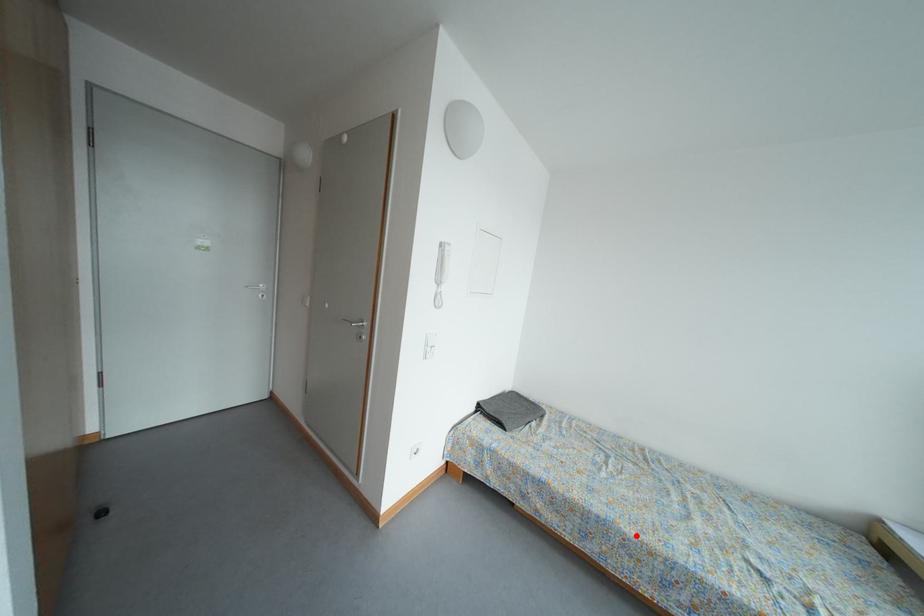
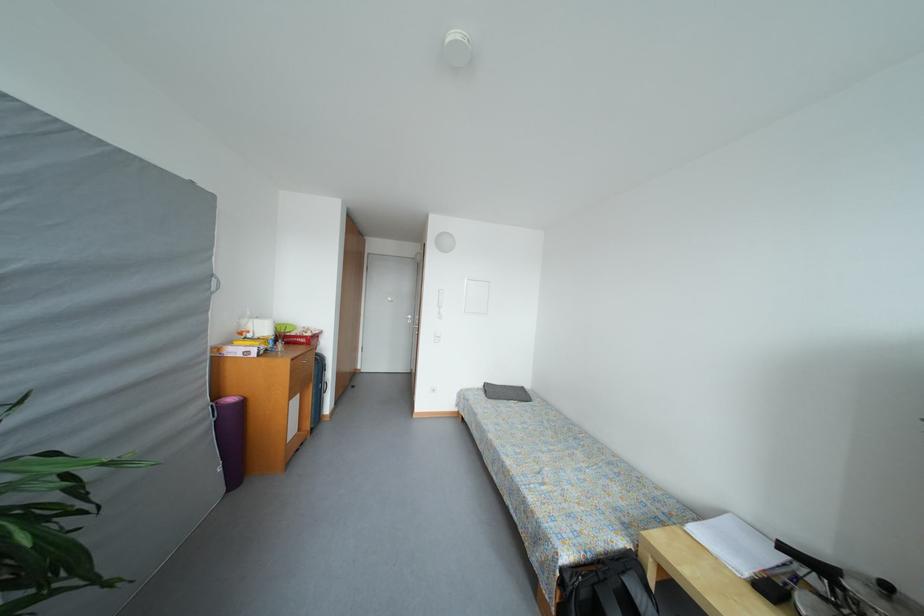
Find the pixel in the second image that matches the highlighted location in the first image.

(496, 440)